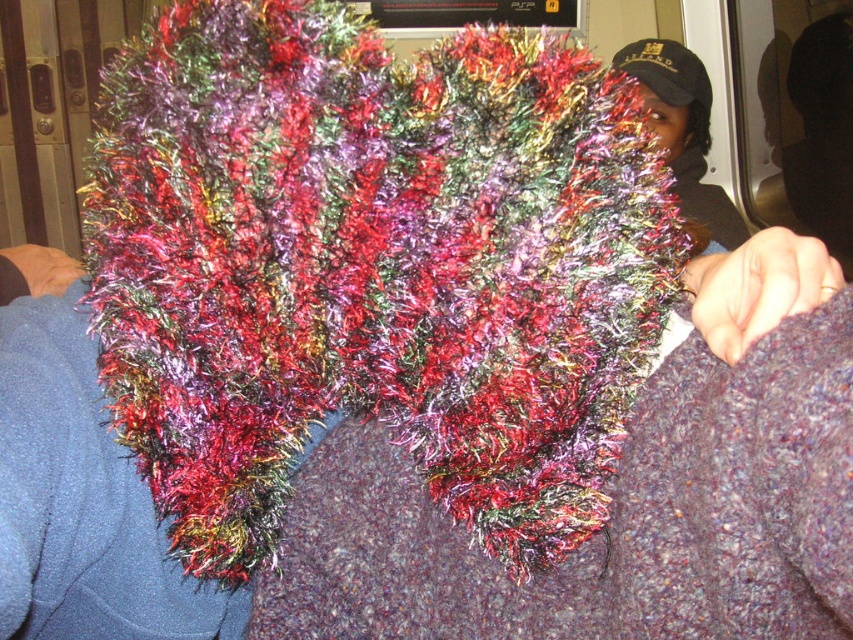
Is shiny multicolored scarf at center behind black textured cap at upper right?

No.

Between shiny multicolored scarf at center and black textured cap at upper right, which one appears on the right side from the viewer's perspective?

Positioned to the right is black textured cap at upper right.

Where is `shiny multicolored scarf at center`? Image resolution: width=853 pixels, height=640 pixels. shiny multicolored scarf at center is located at coordinates (372, 268).

The height and width of the screenshot is (640, 853). Identify the location of shiny multicolored scarf at center. (372, 268).